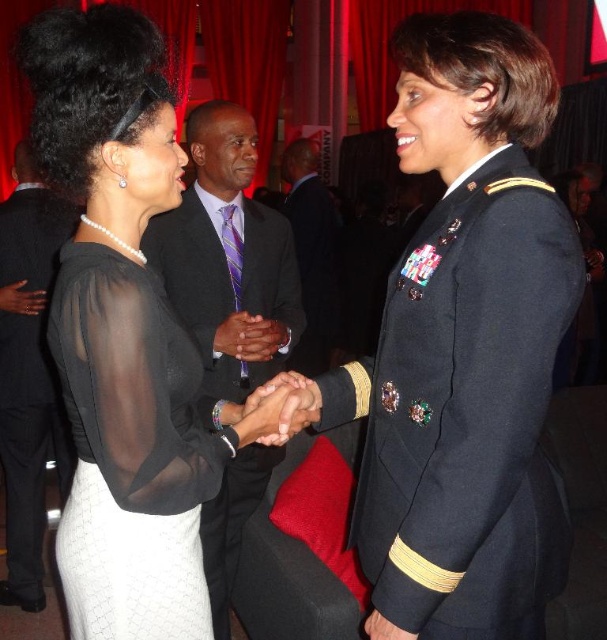
Who is higher up, black sheer blouse at center or matte black suit at center?

Positioned higher is black sheer blouse at center.

Image resolution: width=607 pixels, height=640 pixels. Describe the element at coordinates (124, 336) in the screenshot. I see `black sheer blouse at center` at that location.

The image size is (607, 640). Identify the location of black sheer blouse at center. (124, 336).

Which is above, navy blue fabric military uniform at center or sheer black blouse at center?

navy blue fabric military uniform at center is above.

Does navy blue fabric military uniform at center have a greater width compared to sheer black blouse at center?

Yes, navy blue fabric military uniform at center is wider than sheer black blouse at center.

Which is in front, point (458, 465) or point (186, 420)?

Point (458, 465) is in front.

Identify the location of navy blue fabric military uniform at center. (464, 406).

Is point (195, 472) farther from camera compared to point (15, 522)?

No, it is not.

Identify the location of sheer black blouse at center. The width and height of the screenshot is (607, 640). (134, 392).